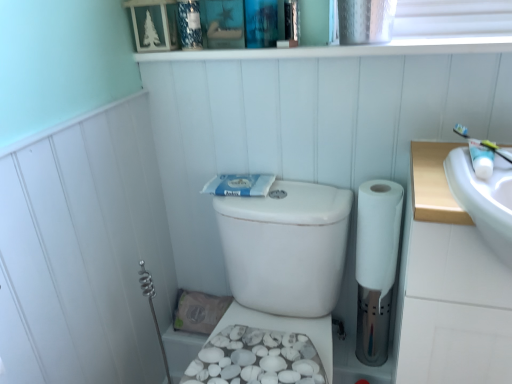
Image resolution: width=512 pixels, height=384 pixels. Find the location of `free space to the left of white glossy toothpaste tube at upper right, which ranks as the first toiletry in bottom-to-top order`. free space to the left of white glossy toothpaste tube at upper right, which ranks as the first toiletry in bottom-to-top order is located at coordinates (439, 176).